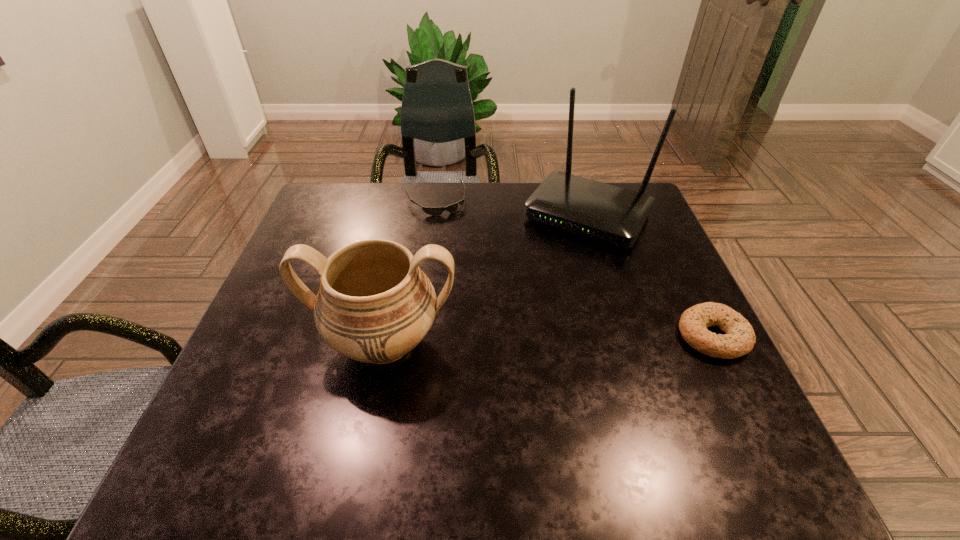
This screenshot has height=540, width=960. In order to click on urn in this screenshot , I will do `click(374, 305)`.

Identify the location of the second shortest object. click(739, 340).

The image size is (960, 540). Identify the location of sunglasses. (434, 211).

Where is `router`? This screenshot has width=960, height=540. router is located at coordinates (610, 214).

Find the location of a particular element. This screenshot has height=540, width=960. vacant space positioned on the front-facing side of the urn is located at coordinates (369, 424).

This screenshot has width=960, height=540. Find the location of `free location located 0.310m on the back of the third tallest object`. free location located 0.310m on the back of the third tallest object is located at coordinates (660, 227).

Identify the location of vacant space located 0.130m on the front-facing side of the sunglasses. The width and height of the screenshot is (960, 540). (458, 242).

The image size is (960, 540). Identify the location of blank space located 0.110m on the front-facing side of the sunglasses. (455, 238).

Image resolution: width=960 pixels, height=540 pixels. Find the location of `free space located 0.160m on the front-facing side of the sunglasses`. free space located 0.160m on the front-facing side of the sunglasses is located at coordinates (461, 249).

This screenshot has height=540, width=960. Find the location of `free space located on the front-facing side of the router`. free space located on the front-facing side of the router is located at coordinates (499, 342).